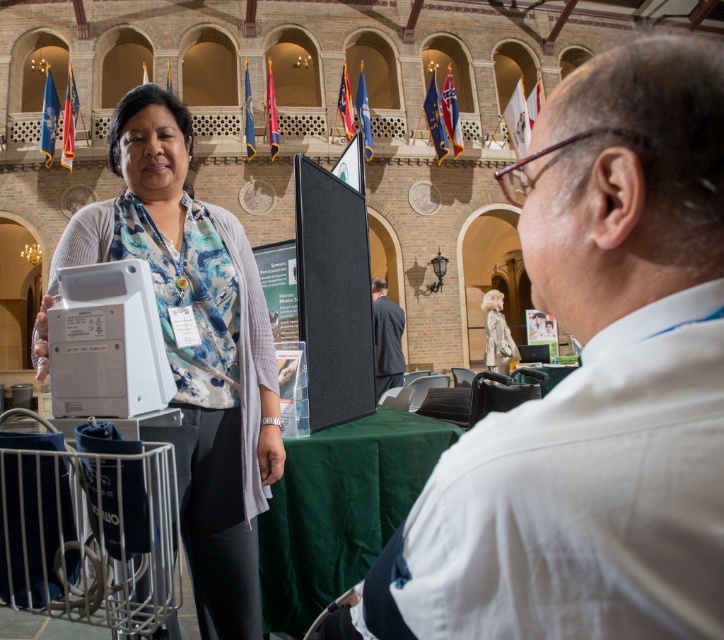
What do you see at coordinates (594, 384) in the screenshot?
I see `white shirt at upper right` at bounding box center [594, 384].

Which is in front, point (607, 410) or point (232, 550)?

Point (607, 410) is more forward.

Between point (652, 81) and point (161, 285), which one is positioned in front?

Point (652, 81) is in front.

Identify the location of white shirt at upper right. (594, 384).

Does white shirt at upper right have a larger size compared to dark gray suit at center?

No.

Between white shirt at upper right and dark gray suit at center, which one appears on the left side from the viewer's perspective?

dark gray suit at center is more to the left.

The height and width of the screenshot is (640, 724). What do you see at coordinates (594, 384) in the screenshot?
I see `white shirt at upper right` at bounding box center [594, 384].

I want to click on white shirt at upper right, so click(x=594, y=384).

Between white shirt at upper right and light beige fabric coat at center, which one is positioned higher?

Positioned higher is white shirt at upper right.

Between white shirt at upper right and light beige fabric coat at center, which one is positioned lower?

light beige fabric coat at center is below.

Which is behind, point (675, 483) or point (500, 349)?

The point (500, 349) is behind.

Locate an element on the screen. white shirt at upper right is located at coordinates (594, 384).